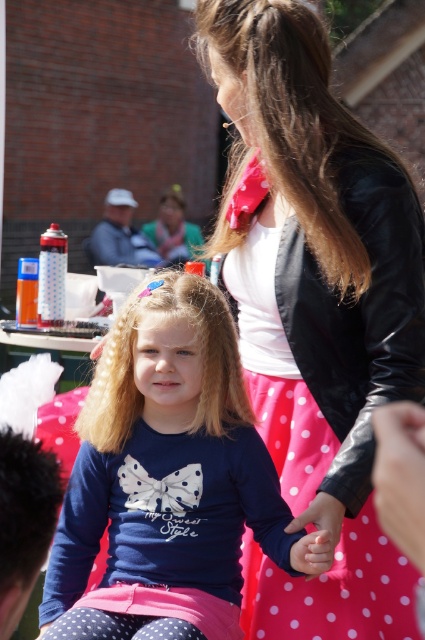
Which is behind, point (235, 404) or point (317, 512)?

Positioned behind is point (235, 404).

Can you confirm if blondehair at center is bigger than smooth skin hand at center?

Indeed, blondehair at center has a larger size compared to smooth skin hand at center.

Who is more distant from viewer, (116, 394) or (331, 496)?

Point (116, 394)

Identify the location of blondehair at center. (133, 364).

Does blue matte shirt at center have a greater height compared to blondehair at center?

Yes.

Between point (93, 483) and point (240, 387), which one is positioned behind?

Positioned behind is point (93, 483).

Between point (155, 458) and point (153, 298), which one is positioned behind?

Point (155, 458)

Locate an element on the screen. This screenshot has width=425, height=640. blue matte shirt at center is located at coordinates (167, 458).

Which of these two, blue matte shirt at center or matte pink fabric at lower center, stands taller?

blue matte shirt at center

Does blue matte shirt at center appear over matte pink fabric at lower center?

Indeed, blue matte shirt at center is positioned over matte pink fabric at lower center.

What are the coordinates of `blue matte shirt at center` in the screenshot? It's located at (167, 458).

Identify the location of blue matte shirt at center. The image size is (425, 640). (167, 458).